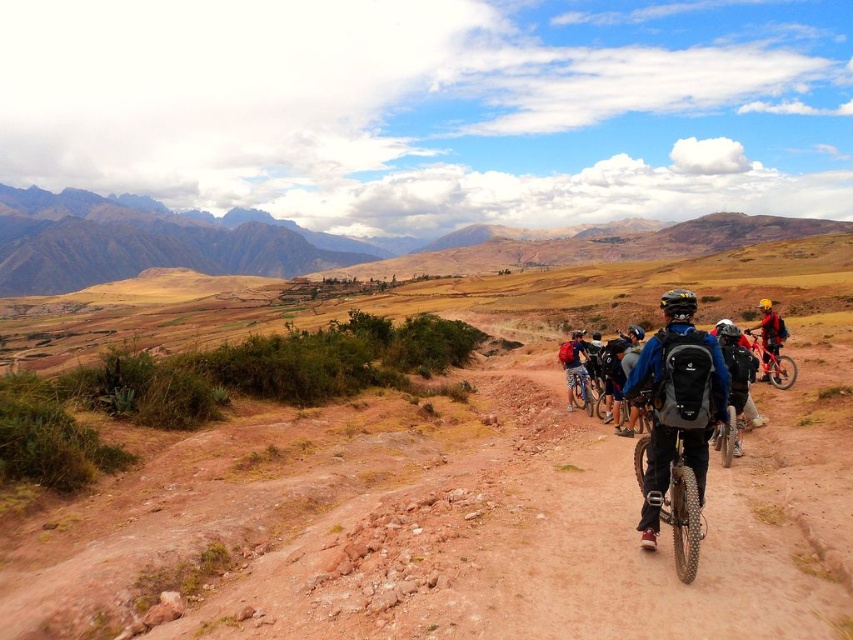
Which is more to the left, red matte bicycle at right or shiny red mountain bike at right?

Positioned to the left is shiny red mountain bike at right.

The height and width of the screenshot is (640, 853). Describe the element at coordinates (770, 337) in the screenshot. I see `red matte bicycle at right` at that location.

The width and height of the screenshot is (853, 640). What do you see at coordinates (770, 337) in the screenshot? I see `red matte bicycle at right` at bounding box center [770, 337].

At what (x,y) coordinates should I click in order to perform the action: click on red matte bicycle at right. Please return your answer as a coordinate pair (x, y). The height and width of the screenshot is (640, 853). Looking at the image, I should click on (770, 337).

Who is lower down, red matte bicycle at right or matte black bicycle at center?

matte black bicycle at center is below.

Who is more forward, (766, 362) or (572, 388)?

Positioned in front is point (766, 362).

This screenshot has height=640, width=853. In order to click on red matte bicycle at right in this screenshot , I will do `click(770, 337)`.

Does point (45, 284) come behind point (766, 326)?

That is True.

You are a GUI agent. You are given a task and a screenshot of the screen. Output one action in this format:
    pyautogui.click(x=<x>, y=<y>)
    Task: Click on the rugged brown mountains at upper left
    This screenshot has width=853, height=640.
    Given the screenshot: What is the action you would take?
    pyautogui.click(x=143, y=241)

Between point (175, 244) and point (769, 364), which one is positioned in front?

Point (769, 364)

Find the location of a particular element. This screenshot has height=640, width=853. rugged brown mountains at upper left is located at coordinates (143, 241).